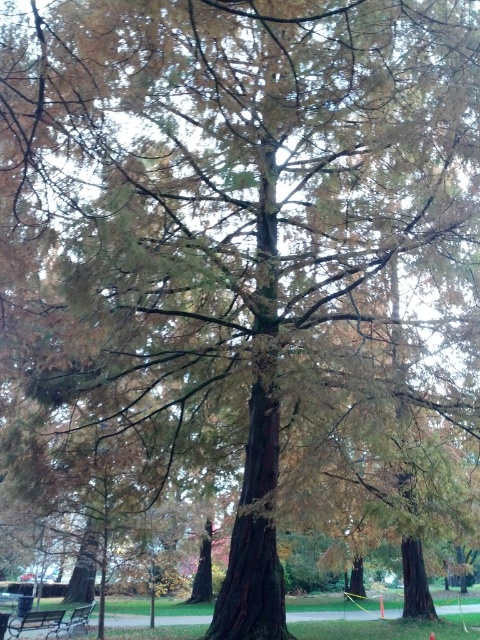
You are planning to set up a small gathering area in the park. You have a 6 feet long tablecloth. You see the wooden bench at lower left and the wooden picnic table at lower left. Can you place the tablecloth between them to cover the space between the two objects?

The wooden bench at lower left and wooden picnic table at lower left are 5.79 feet apart from each other. Since the tablecloth is 6 feet long, it can cover the space between them.

You are a visitor in a park and want to sit on one of the benches. You see a metallic park bench at lower left and a wooden bench at lower left. Which bench is higher up from the ground?

The metallic park bench at lower left is above the wooden bench at lower left, so it is higher up from the ground.

Consider the image. You are sitting on the wooden bench at lower left and want to place a book on the wooden picnic table at lower left. Can you reach it without standing up?

The wooden bench at lower left has a lesser height compared to wooden picnic table at lower left, so you cannot reach the picnic table without standing up because the bench is lower than the table.